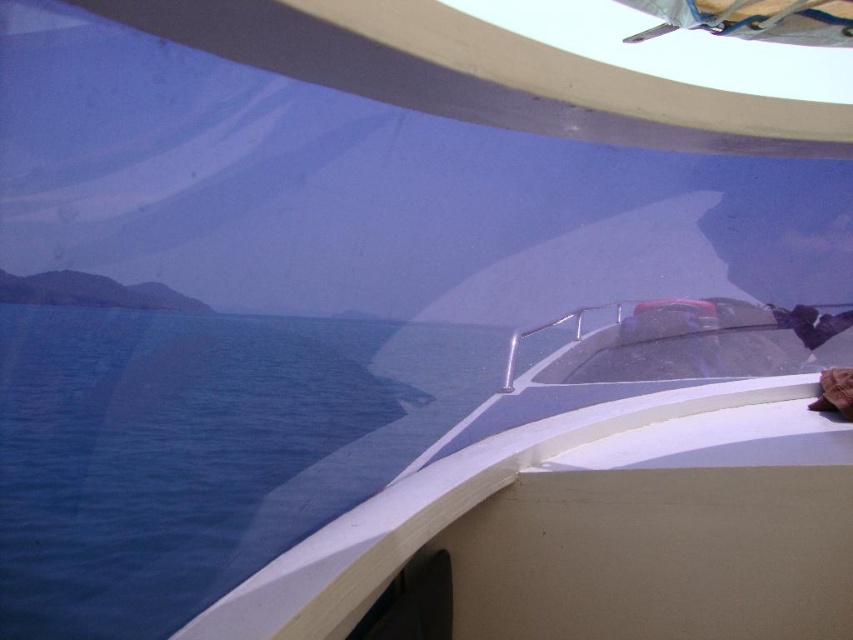
You are standing on the deck of the boat and want to take a photo of the white glossy boat at center and the blue water at lower left. Which object should you focus on first if you want to capture both in one shot, considering their sizes?

The white glossy boat at center is larger than the blue water at lower left, so you should focus on the white glossy boat at center first to ensure it is in sharp focus before adjusting for the blue water at lower left.

You are a passenger on the boat and want to know if you can see the entire white glossy boat at center from your current position near the blue water at lower left. Based on their sizes, can you see the entire boat?

The white glossy boat at center is shorter than the blue water at lower left. Since the boat is shorter, it is possible to see its entire structure from the blue water at lower left as it does not obstruct the view due to its smaller height.